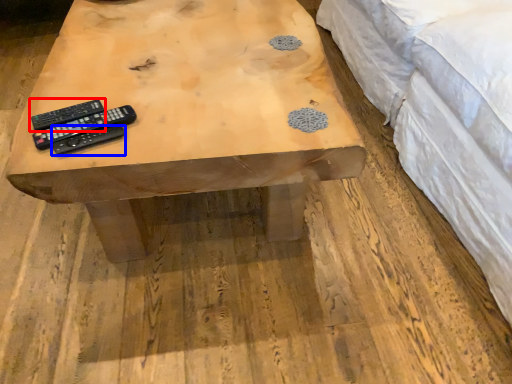
Question: Which object is closer to the camera taking this photo, remote control (highlighted by a red box) or remote control (highlighted by a blue box)?

Choices:
 (A) remote control
 (B) remote control

Answer: (B)